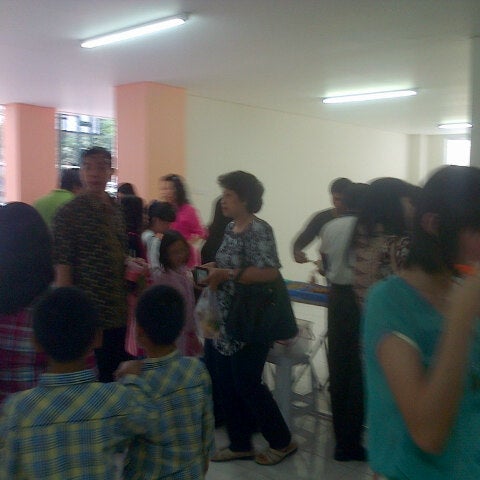
What are the coordinates of `floor` in the screenshot? It's located at (429, 24).